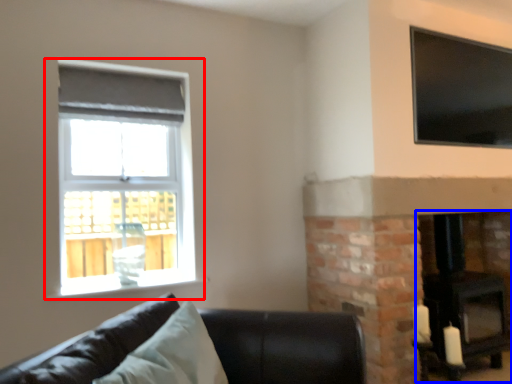
Question: Among these objects, which one is nearest to the camera, window (highlighted by a red box) or fireplace (highlighted by a blue box)?

Choices:
 (A) window
 (B) fireplace

Answer: (A)